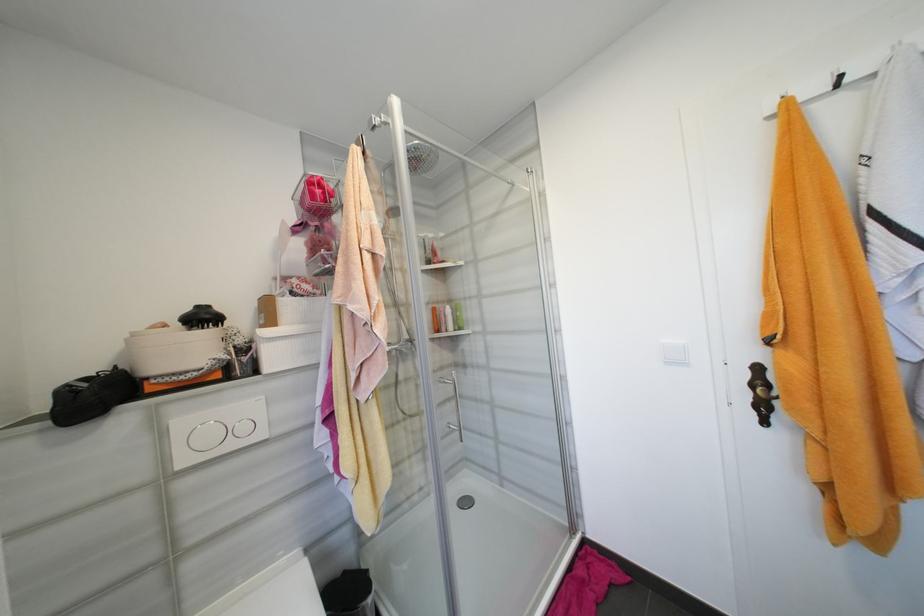
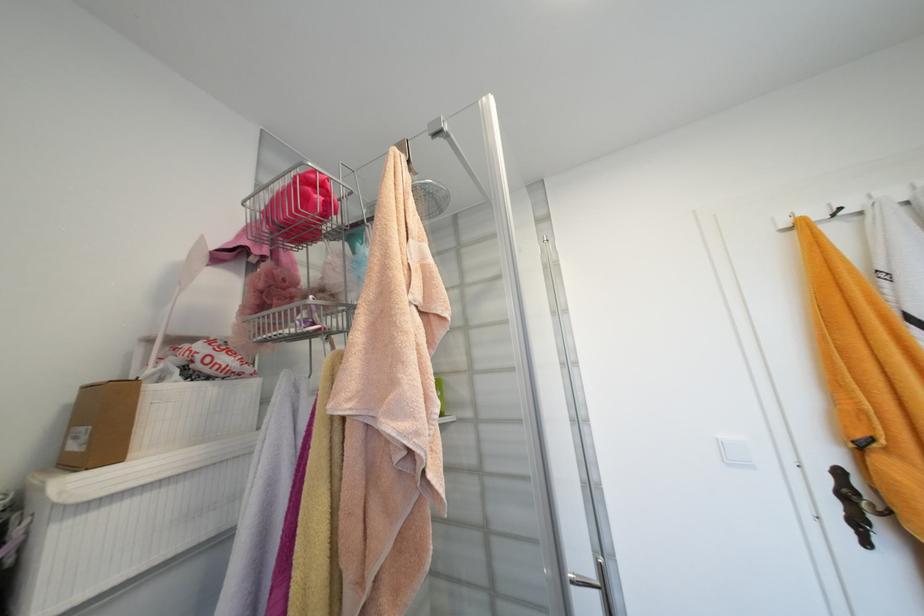
The point at (779, 111) is marked in the first image. Where is the corresponding point in the second image?

(792, 225)